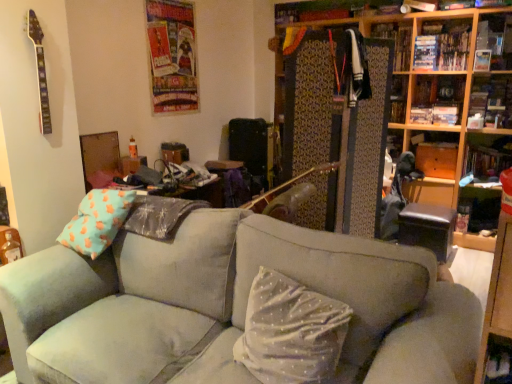
Question: Is wooden bookshelf at right, marked as the first shelf in a bottom-to-top arrangement, looking in the opposite direction of wooden bookshelf at upper right?

Choices:
 (A) no
 (B) yes

Answer: (B)

Question: Can you confirm if wooden bookshelf at right, the fourth shelf in the top-to-bottom sequence, is positioned to the left of wooden bookshelf at upper right?

Choices:
 (A) yes
 (B) no

Answer: (B)

Question: Does wooden bookshelf at right, marked as the first shelf in a bottom-to-top arrangement, come in front of wooden bookshelf at upper right?

Choices:
 (A) yes
 (B) no

Answer: (B)

Question: From a real-world perspective, is wooden bookshelf at right, the fourth shelf in the top-to-bottom sequence, beneath wooden bookshelf at upper right?

Choices:
 (A) yes
 (B) no

Answer: (A)

Question: Is wooden bookshelf at right, marked as the first shelf in a bottom-to-top arrangement, facing towards wooden bookshelf at upper right?

Choices:
 (A) no
 (B) yes

Answer: (B)

Question: From a real-world perspective, is wooden bookshelf at right, marked as the first shelf in a bottom-to-top arrangement, above or below wooden bookshelf at upper right?

Choices:
 (A) below
 (B) above

Answer: (A)

Question: In terms of size, does wooden bookshelf at right, marked as the first shelf in a bottom-to-top arrangement, appear bigger or smaller than wooden bookshelf at upper right?

Choices:
 (A) big
 (B) small

Answer: (B)

Question: In the image, is wooden bookshelf at right, marked as the first shelf in a bottom-to-top arrangement, on the left side or the right side of wooden bookshelf at upper right?

Choices:
 (A) left
 (B) right

Answer: (B)

Question: Is wooden bookshelf at right, the fourth shelf in the top-to-bottom sequence, in front of or behind wooden bookshelf at upper right in the image?

Choices:
 (A) front
 (B) behind

Answer: (B)

Question: Which is correct: hardcover book at upper right is inside wooden bookshelf at upper right, or outside of it?

Choices:
 (A) inside
 (B) outside

Answer: (A)

Question: Is point (421, 44) positioned closer to the camera than point (432, 158)?

Choices:
 (A) closer
 (B) farther

Answer: (A)

Question: In terms of height, does hardcover book at upper right look taller or shorter compared to wooden bookshelf at upper right?

Choices:
 (A) tall
 (B) short

Answer: (B)

Question: From the image's perspective, relative to wooden bookshelf at upper right, is hardcover book at upper right above or below?

Choices:
 (A) below
 (B) above

Answer: (B)

Question: Considering the positions of suede gray couch at center and wooden bookshelf at right, marked as the first shelf in a bottom-to-top arrangement, in the image, is suede gray couch at center wider or thinner than wooden bookshelf at right, marked as the first shelf in a bottom-to-top arrangement,?

Choices:
 (A) thin
 (B) wide

Answer: (B)

Question: Considering their positions, is suede gray couch at center located in front of or behind wooden bookshelf at right, marked as the first shelf in a bottom-to-top arrangement?

Choices:
 (A) behind
 (B) front

Answer: (B)